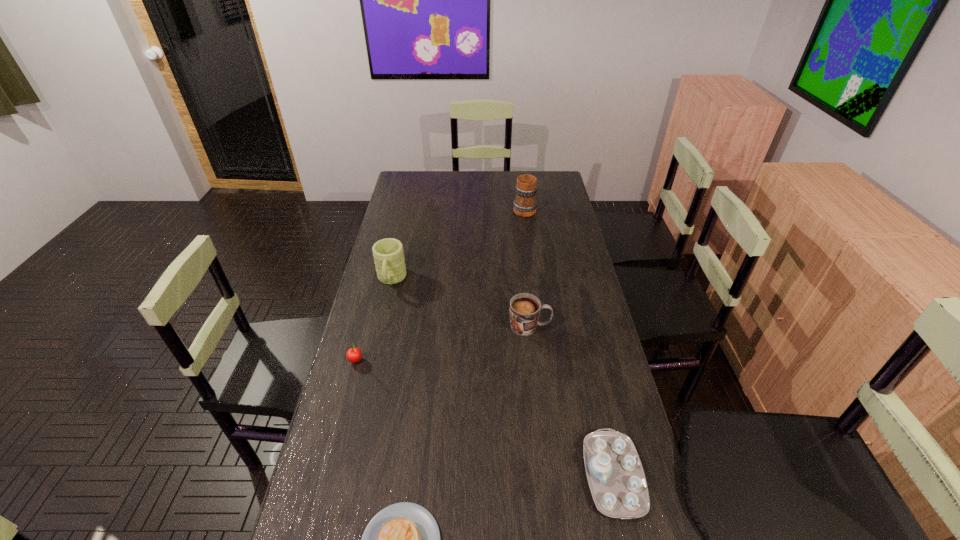
Where is `vacant space at the right edge`? The width and height of the screenshot is (960, 540). vacant space at the right edge is located at coordinates (559, 328).

Locate an element on the screen. The height and width of the screenshot is (540, 960). vacant space in between the fourth farthest object and the tallest object is located at coordinates (440, 285).

Where is `blank region between the third farthest object and the rightmost object`? This screenshot has height=540, width=960. blank region between the third farthest object and the rightmost object is located at coordinates (571, 401).

The width and height of the screenshot is (960, 540). Find the location of `vacant space that is in between the third nearest object and the farthest object`. vacant space that is in between the third nearest object and the farthest object is located at coordinates (440, 285).

The width and height of the screenshot is (960, 540). In order to click on unoccupied position between the tallest object and the nearest mug in this screenshot , I will do `click(527, 268)`.

I want to click on vacant space that's between the fifth nearest object and the farthest mug, so click(458, 244).

You are a GUI agent. You are given a task and a screenshot of the screen. Output one action in this format:
    pyautogui.click(x=<x>, y=<y>)
    Task: Click on the free space between the rightmost object and the second farthest mug
    This screenshot has width=960, height=540.
    Given the screenshot: What is the action you would take?
    pyautogui.click(x=502, y=378)

You are a GUI agent. You are given a task and a screenshot of the screen. Output one action in this format:
    pyautogui.click(x=<x>, y=<y>)
    Task: Click on the vacant area between the tallest mug and the second shortest mug
    
    Given the screenshot: What is the action you would take?
    pyautogui.click(x=458, y=244)

Locate an element on the screen. object that is the fifth nearest to the fourth nearest object is located at coordinates (525, 204).

You are a GUI agent. You are given a task and a screenshot of the screen. Output one action in this format:
    pyautogui.click(x=<x>, y=<y>)
    Task: Click on the object that stands as the second closest to the tallest object
    
    Given the screenshot: What is the action you would take?
    pyautogui.click(x=525, y=308)